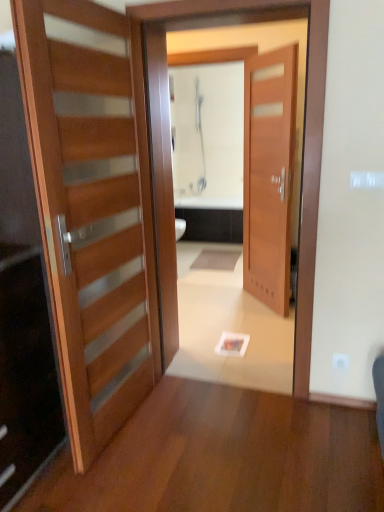
You are a GUI agent. You are given a task and a screenshot of the screen. Output one action in this format:
    pyautogui.click(x=<x>, y=<y>)
    Task: Click on the vacant area situated below wooden door at center (from a real-world perspective)
    
    Given the screenshot: What is the action you would take?
    pyautogui.click(x=223, y=370)